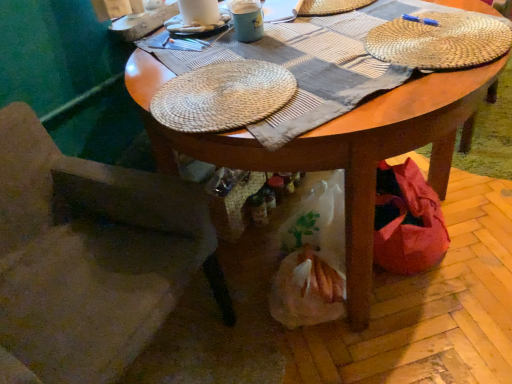
Image resolution: width=512 pixels, height=384 pixels. What do you see at coordinates (89, 255) in the screenshot?
I see `suede-like beige chair at lower left` at bounding box center [89, 255].

Find the location of `matte ceramic mug at upper center`. matte ceramic mug at upper center is located at coordinates (247, 20).

This screenshot has height=384, width=512. I want to click on woven straw placemat at center, which is the 3th hat in top-to-bottom order, so click(x=223, y=96).

The width and height of the screenshot is (512, 384). What do you see at coordinates (439, 40) in the screenshot?
I see `woven straw placemat at upper right, which appears as the 2th hat when viewed from the top` at bounding box center [439, 40].

The width and height of the screenshot is (512, 384). Describe the element at coordinates (331, 7) in the screenshot. I see `white woven hat at upper center, the 1th hat from the top` at that location.

The image size is (512, 384). I want to click on suede-like beige chair at lower left, so click(x=89, y=255).

Would you consider woven straw placemat at center, which is the first hat in bottom-to-top order, to be distant from white woven hat at upper center, the 1th hat from the top?

No, woven straw placemat at center, which is the first hat in bottom-to-top order, is not far from white woven hat at upper center, the 1th hat from the top.

Between woven straw placemat at center, which is the 3th hat in top-to-bottom order, and white woven hat at upper center, the third hat from the bottom, which one has smaller width?

white woven hat at upper center, the third hat from the bottom, is thinner.

In the image, is woven straw placemat at center, which is the first hat in bottom-to-top order, on the left side or the right side of white woven hat at upper center, the third hat from the bottom?

Clearly, woven straw placemat at center, which is the first hat in bottom-to-top order, is on the left of white woven hat at upper center, the third hat from the bottom, in the image.

From a real-world perspective, between woven straw placemat at center, which is the first hat in bottom-to-top order, and white woven hat at upper center, the third hat from the bottom, who is vertically higher?

In real-world perspective, woven straw placemat at center, which is the first hat in bottom-to-top order, is above.

Looking at this image, is woven straw placemat at upper right, which appears as the 2th hat when viewed from the top, turned away from white woven hat at upper center, the third hat from the bottom?

woven straw placemat at upper right, which appears as the 2th hat when viewed from the top, does not have its back to white woven hat at upper center, the third hat from the bottom.

What's the angular difference between woven straw placemat at upper right, which appears as the 2th hat when viewed from the top, and white woven hat at upper center, the 1th hat from the top,'s facing directions?

There is a 92.3-degree angle between the facing directions of woven straw placemat at upper right, which appears as the 2th hat when viewed from the top, and white woven hat at upper center, the 1th hat from the top.

Is woven straw placemat at upper right, which appears as the 2th hat when ordered from the bottom, to the right of white woven hat at upper center, the 1th hat from the top, from the viewer's perspective?

Indeed, woven straw placemat at upper right, which appears as the 2th hat when ordered from the bottom, is positioned on the right side of white woven hat at upper center, the 1th hat from the top.

Considering the sizes of objects woven straw placemat at upper right, which appears as the 2th hat when viewed from the top, and white woven hat at upper center, the 1th hat from the top, in the image provided, who is taller, woven straw placemat at upper right, which appears as the 2th hat when viewed from the top, or white woven hat at upper center, the 1th hat from the top,?

woven straw placemat at upper right, which appears as the 2th hat when viewed from the top.

Looking at this image, from the image's perspective, does wooden table at center appear lower than woven straw placemat at upper right, which appears as the 2th hat when viewed from the top?

Yes.

Measure the distance between wooden table at center and woven straw placemat at upper right, which appears as the 2th hat when viewed from the top.

They are 10.34 inches apart.

How many degrees apart are the facing directions of wooden table at center and woven straw placemat at upper right, which appears as the 2th hat when ordered from the bottom?

The facing directions of wooden table at center and woven straw placemat at upper right, which appears as the 2th hat when ordered from the bottom, are 6.85 degrees apart.

Does point (439, 190) come in front of point (392, 45)?

No, it is behind (392, 45).

Can you confirm if woven straw placemat at center, which is the first hat in bottom-to-top order, is wider than matte ceramic mug at upper center?

Yes, woven straw placemat at center, which is the first hat in bottom-to-top order, is wider than matte ceramic mug at upper center.

Where is `coffee cup above the woven straw placemat at center, which is the 3th hat in top-to-bottom order (from a real-world perspective)`? This screenshot has height=384, width=512. coffee cup above the woven straw placemat at center, which is the 3th hat in top-to-bottom order (from a real-world perspective) is located at coordinates (247, 20).

From the image's perspective, does woven straw placemat at center, which is the first hat in bottom-to-top order, appear higher than matte ceramic mug at upper center?

Actually, woven straw placemat at center, which is the first hat in bottom-to-top order, appears below matte ceramic mug at upper center in the image.

Is white woven hat at upper center, the third hat from the bottom, bigger or smaller than suede-like beige chair at lower left?

In the image, white woven hat at upper center, the third hat from the bottom, appears to be smaller than suede-like beige chair at lower left.

Looking at this image, from their relative heights in the image, would you say white woven hat at upper center, the third hat from the bottom, is taller or shorter than suede-like beige chair at lower left?

Clearly, white woven hat at upper center, the third hat from the bottom, is shorter compared to suede-like beige chair at lower left.

Is white woven hat at upper center, the third hat from the bottom, outside of suede-like beige chair at lower left?

white woven hat at upper center, the third hat from the bottom, lies outside suede-like beige chair at lower left's area.

Is white woven hat at upper center, the 1th hat from the top, wider than suede-like beige chair at lower left?

No, white woven hat at upper center, the 1th hat from the top, is not wider than suede-like beige chair at lower left.

Based on the photo, is white woven hat at upper center, the third hat from the bottom, outside of wooden table at center?

No, white woven hat at upper center, the third hat from the bottom, is not entirely external to wooden table at center.

Find the location of `desk below the white woven hat at upper center, the third hat from the bottom (from a real-world perspective)`. desk below the white woven hat at upper center, the third hat from the bottom (from a real-world perspective) is located at coordinates (337, 147).

In the image, is white woven hat at upper center, the 1th hat from the top, on the left side or the right side of wooden table at center?

white woven hat at upper center, the 1th hat from the top, is positioned on wooden table at center's right side.

Is white woven hat at upper center, the third hat from the bottom, oriented towards wooden table at center?

Yes, white woven hat at upper center, the third hat from the bottom, is turned towards wooden table at center.

Is the depth of white woven hat at upper center, the 1th hat from the top, greater than that of woven straw placemat at center, which is the first hat in bottom-to-top order?

Yes, white woven hat at upper center, the 1th hat from the top, is further from the camera.

Is white woven hat at upper center, the 1th hat from the top, far away from woven straw placemat at center, which is the first hat in bottom-to-top order?

white woven hat at upper center, the 1th hat from the top, is near woven straw placemat at center, which is the first hat in bottom-to-top order, not far away.

I want to click on hat that appears above the white woven hat at upper center, the 1th hat from the top (from a real-world perspective), so click(x=223, y=96).

From the image's perspective, which object appears higher, white woven hat at upper center, the 1th hat from the top, or woven straw placemat at center, which is the first hat in bottom-to-top order?

white woven hat at upper center, the 1th hat from the top, is shown above in the image.

Locate an element on the screen. This screenshot has width=512, height=384. the 1st hat to the right of the woven straw placemat at center, which is the 3th hat in top-to-bottom order, counting from the anchor's position is located at coordinates (331, 7).

In order to click on the 1st hat above the woven straw placemat at upper right, which appears as the 2th hat when ordered from the bottom (from a real-world perspective) in this screenshot , I will do `click(331, 7)`.

When comparing their distances from wooden table at center, does matte ceramic mug at upper center or woven straw placemat at center, which is the 3th hat in top-to-bottom order, seem further?

matte ceramic mug at upper center is positioned further to the anchor wooden table at center.

Based on the photo, estimate the real-world distances between objects in this image. Which object is closer to woven straw placemat at center, which is the first hat in bottom-to-top order, wooden table at center or white woven hat at upper center, the 1th hat from the top?

The object closer to woven straw placemat at center, which is the first hat in bottom-to-top order, is wooden table at center.

When comparing their distances from matte ceramic mug at upper center, does woven straw placemat at center, which is the first hat in bottom-to-top order, or woven straw placemat at upper right, which appears as the 2th hat when ordered from the bottom, seem closer?

woven straw placemat at center, which is the first hat in bottom-to-top order, lies closer to matte ceramic mug at upper center than the other object.

Looking at the image, which one is located further to matte ceramic mug at upper center, woven straw placemat at center, which is the 3th hat in top-to-bottom order, or wooden table at center?

wooden table at center lies further to matte ceramic mug at upper center than the other object.

Estimate the real-world distances between objects in this image. Which object is further from white woven hat at upper center, the 1th hat from the top, matte ceramic mug at upper center or woven straw placemat at upper right, which appears as the 2th hat when ordered from the bottom?

Based on the image, woven straw placemat at upper right, which appears as the 2th hat when ordered from the bottom, appears to be further to white woven hat at upper center, the 1th hat from the top.

Estimate the real-world distances between objects in this image. Which object is further from woven straw placemat at center, which is the 3th hat in top-to-bottom order, wooden table at center or woven straw placemat at upper right, which appears as the 2th hat when ordered from the bottom?

woven straw placemat at upper right, which appears as the 2th hat when ordered from the bottom, lies further to woven straw placemat at center, which is the 3th hat in top-to-bottom order, than the other object.

Based on their spatial positions, is woven straw placemat at center, which is the first hat in bottom-to-top order, or suede-like beige chair at lower left further from matte ceramic mug at upper center?

suede-like beige chair at lower left.

From the image, which object appears to be farther from wooden table at center, woven straw placemat at upper right, which appears as the 2th hat when ordered from the bottom, or white woven hat at upper center, the third hat from the bottom?

Among the two, white woven hat at upper center, the third hat from the bottom, is located further to wooden table at center.

Where is `hat between woven straw placemat at center, which is the first hat in bottom-to-top order, and woven straw placemat at upper right, which appears as the 2th hat when viewed from the top`? The image size is (512, 384). hat between woven straw placemat at center, which is the first hat in bottom-to-top order, and woven straw placemat at upper right, which appears as the 2th hat when viewed from the top is located at coordinates 331,7.

Image resolution: width=512 pixels, height=384 pixels. I want to click on hat between suede-like beige chair at lower left and wooden table at center, so click(223, 96).

At what (x,y) coordinates should I click in order to perform the action: click on coffee cup between woven straw placemat at center, which is the first hat in bottom-to-top order, and woven straw placemat at upper right, which appears as the 2th hat when ordered from the bottom, from left to right. Please return your answer as a coordinate pair (x, y). Image resolution: width=512 pixels, height=384 pixels. Looking at the image, I should click on (247, 20).

Locate an element on the screen. Image resolution: width=512 pixels, height=384 pixels. coffee cup between suede-like beige chair at lower left and woven straw placemat at upper right, which appears as the 2th hat when viewed from the top, in the horizontal direction is located at coordinates tap(247, 20).